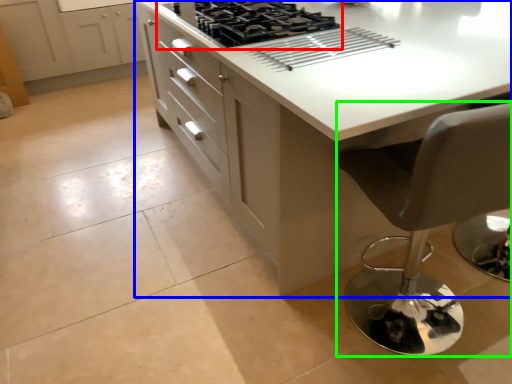
Question: Which is nearer to the gas stove (highlighted by a red box)? countertop (highlighted by a blue box) or chair (highlighted by a green box).

Choices:
 (A) countertop
 (B) chair

Answer: (A)